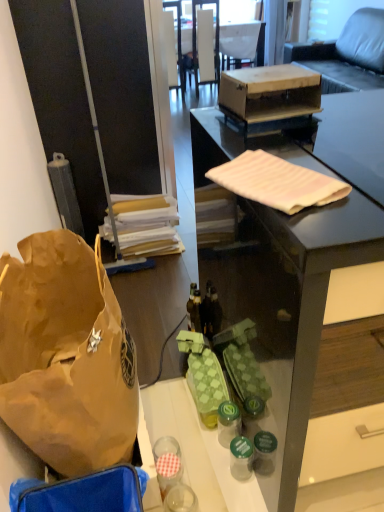
Question: Considering the relative sizes of leather couch at upper right and brown paper bag at left in the image provided, is leather couch at upper right smaller than brown paper bag at left?

Choices:
 (A) yes
 (B) no

Answer: (B)

Question: Does leather couch at upper right have a lesser width compared to brown paper bag at left?

Choices:
 (A) yes
 (B) no

Answer: (B)

Question: Is leather couch at upper right closer to camera compared to brown paper bag at left?

Choices:
 (A) yes
 (B) no

Answer: (B)

Question: Is leather couch at upper right to the right of brown paper bag at left from the viewer's perspective?

Choices:
 (A) yes
 (B) no

Answer: (A)

Question: Does leather couch at upper right come behind brown paper bag at left?

Choices:
 (A) yes
 (B) no

Answer: (A)

Question: Is wooden box at center bigger or smaller than matte black desk at center?

Choices:
 (A) small
 (B) big

Answer: (A)

Question: Is wooden box at center wider or thinner than matte black desk at center?

Choices:
 (A) wide
 (B) thin

Answer: (B)

Question: In the image, is wooden box at center on the left side or the right side of matte black desk at center?

Choices:
 (A) right
 (B) left

Answer: (B)

Question: Is point (309, 88) closer or farther from the camera than point (284, 487)?

Choices:
 (A) farther
 (B) closer

Answer: (A)

Question: Is point (238, 418) positioned closer to the camera than point (251, 453)?

Choices:
 (A) farther
 (B) closer

Answer: (A)

Question: In terms of size, does green plastic bottle at center, placed as the second bottle when sorted from bottom to top, appear bigger or smaller than green glass bottle at lower center, which is counted as the 1th bottle, starting from the front?

Choices:
 (A) big
 (B) small

Answer: (A)

Question: In terms of height, does green plastic bottle at center, the second bottle when ordered from front to back, look taller or shorter compared to green glass bottle at lower center, which ranks as the first bottle in bottom-to-top order?

Choices:
 (A) tall
 (B) short

Answer: (B)

Question: Visually, is green plastic bottle at center, placed as the second bottle when sorted from bottom to top, positioned to the left or to the right of green glass bottle at lower center, which is counted as the 1th bottle, starting from the front?

Choices:
 (A) left
 (B) right

Answer: (A)

Question: Is brown paper bag at left wider or thinner than white fabric armchair at upper center?

Choices:
 (A) wide
 (B) thin

Answer: (B)

Question: Would you say brown paper bag at left is to the left or to the right of white fabric armchair at upper center in the picture?

Choices:
 (A) right
 (B) left

Answer: (B)